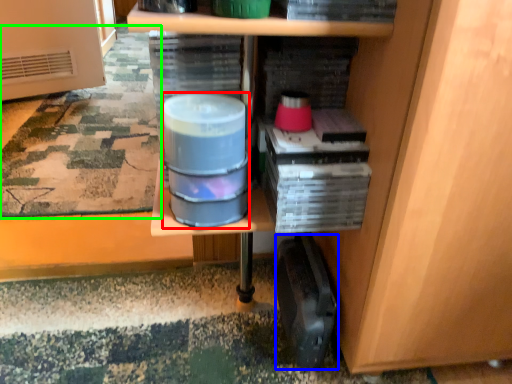
Question: Based on their relative distances, which object is nearer to water (highlighted by a red box)? Choose from wide (highlighted by a blue box) and mat (highlighted by a green box).

Choices:
 (A) wide
 (B) mat

Answer: (A)